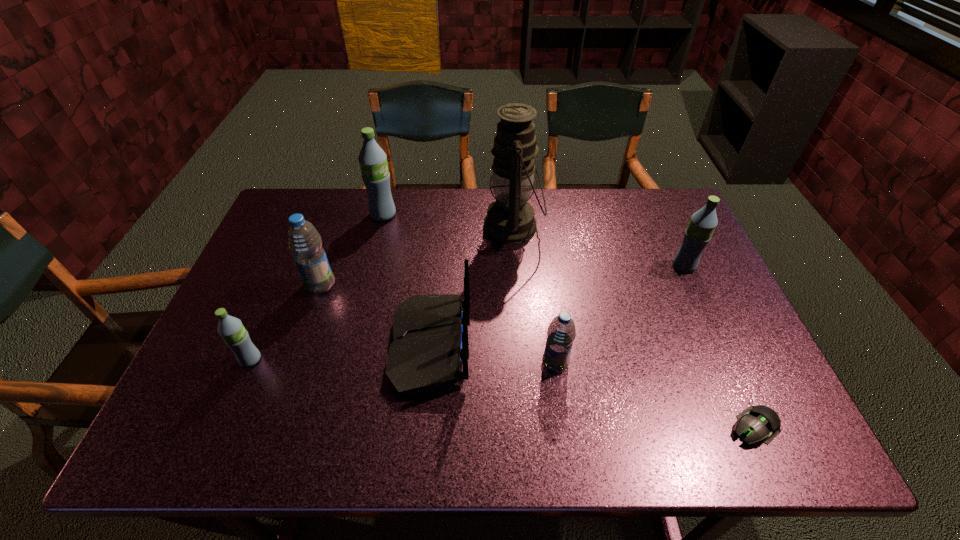
Where is `free space located on the back of the nearer blue water bottle`? The width and height of the screenshot is (960, 540). free space located on the back of the nearer blue water bottle is located at coordinates (544, 286).

Image resolution: width=960 pixels, height=540 pixels. Find the location of `vacant space located on the back of the nearest green water bottle`. vacant space located on the back of the nearest green water bottle is located at coordinates (300, 245).

Where is `vacant area situated on the back of the gray computer mouse`? This screenshot has height=540, width=960. vacant area situated on the back of the gray computer mouse is located at coordinates (731, 374).

In order to click on oil lamp present at the far edge in this screenshot , I will do `click(510, 219)`.

Image resolution: width=960 pixels, height=540 pixels. What are the coordinates of `water bottle that is at the far edge` in the screenshot? It's located at (373, 163).

Identify the location of object that is positioned at the near edge. (758, 423).

The height and width of the screenshot is (540, 960). I want to click on object present at the left edge, so click(x=231, y=329).

Locate an element on the screen. water bottle that is at the right edge is located at coordinates (702, 224).

Identify the location of computer mouse at the right edge. This screenshot has width=960, height=540. (758, 423).

Where is `object located in the near right corner section of the desktop`? This screenshot has height=540, width=960. object located in the near right corner section of the desktop is located at coordinates (758, 423).